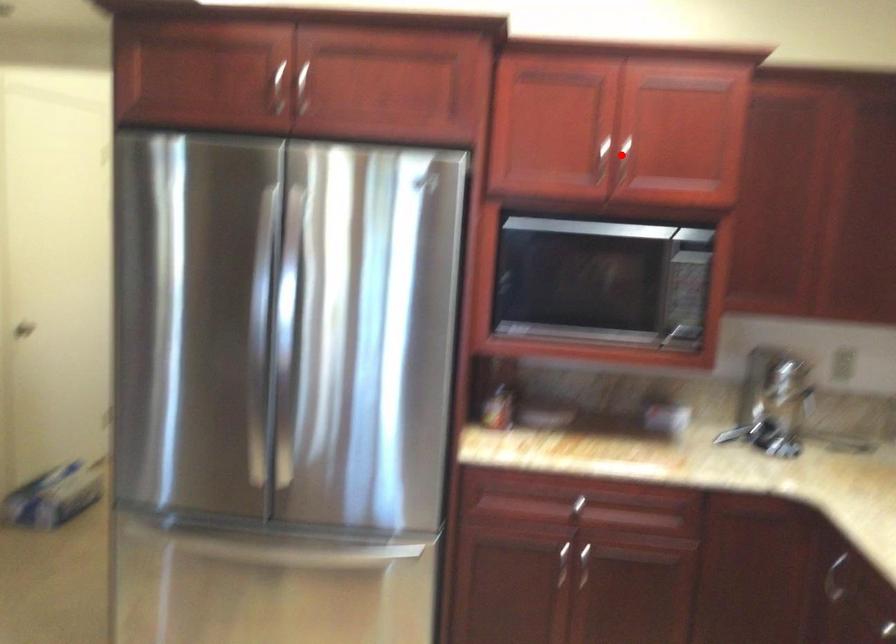
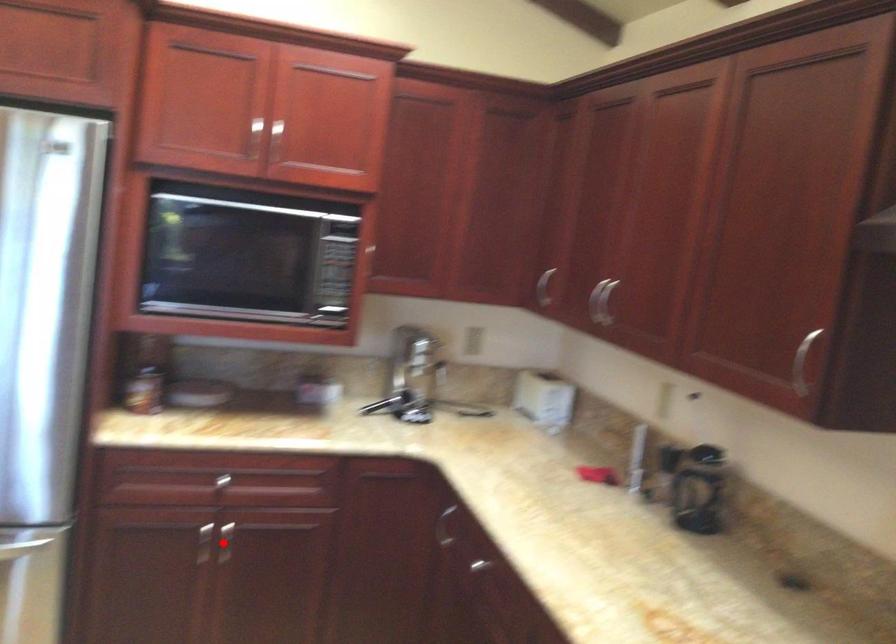
I am providing you with two images of the same scene from different viewpoints. A red point is marked on the first image and another point is marked on the second image. Is the red point in image1 aligned with the point shown in image2?

No